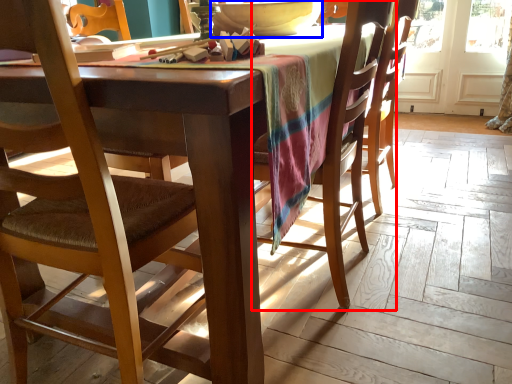
Question: Among these objects, which one is farthest to the camera, chair (highlighted by a red box) or bowl (highlighted by a blue box)?

Choices:
 (A) chair
 (B) bowl

Answer: (B)